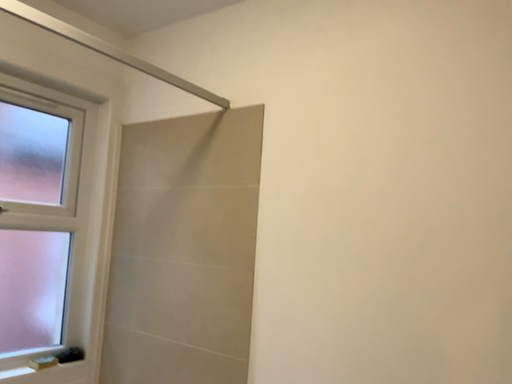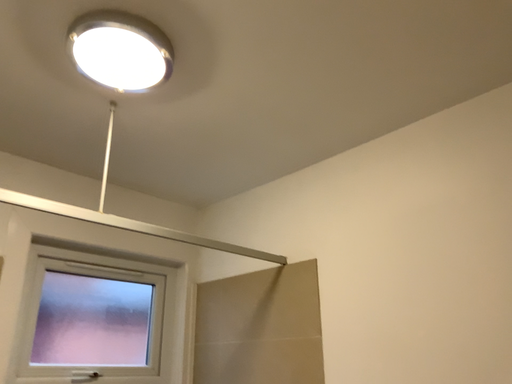
Question: Which way did the camera rotate in the video?

Choices:
 (A) rotated right
 (B) rotated left

Answer: (B)